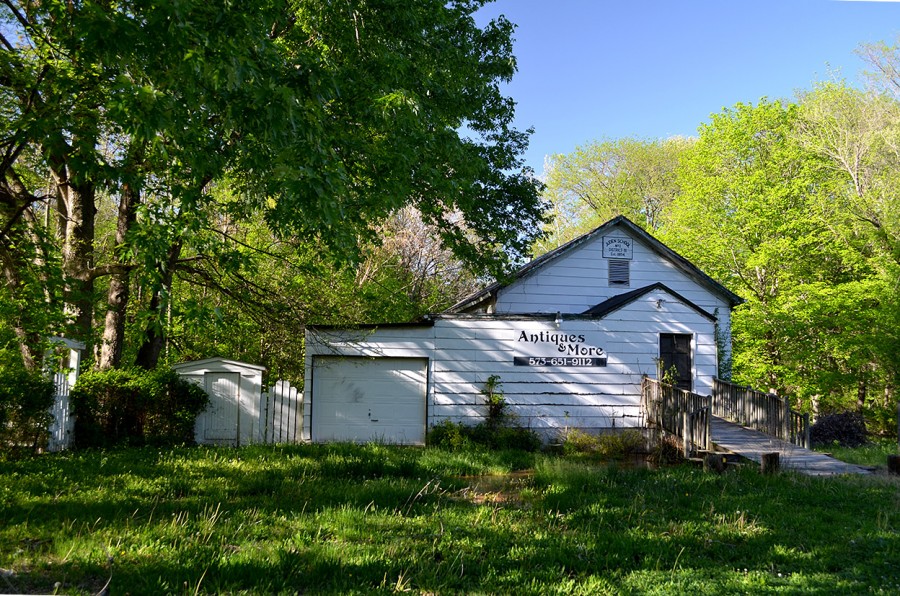
I want to click on handle, so click(x=375, y=418).